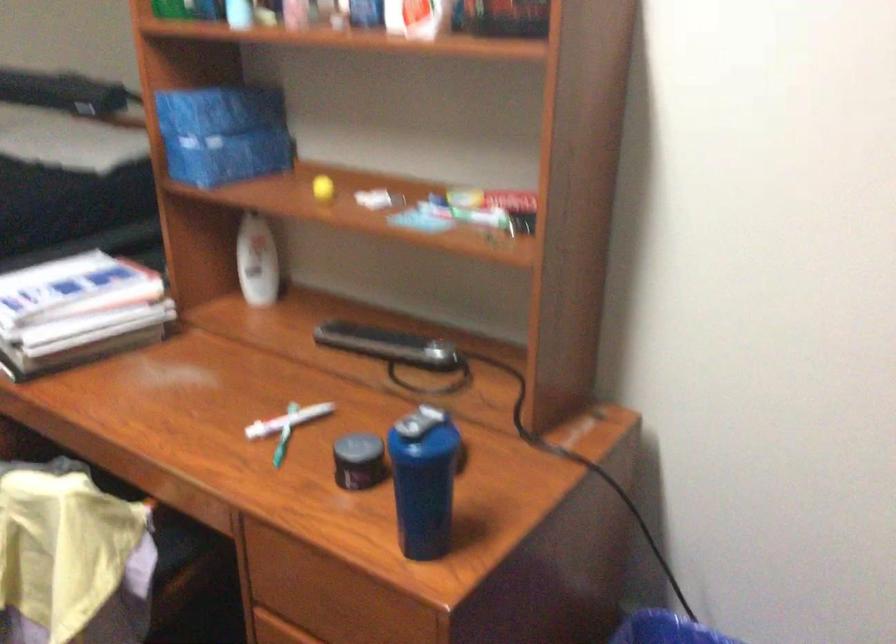
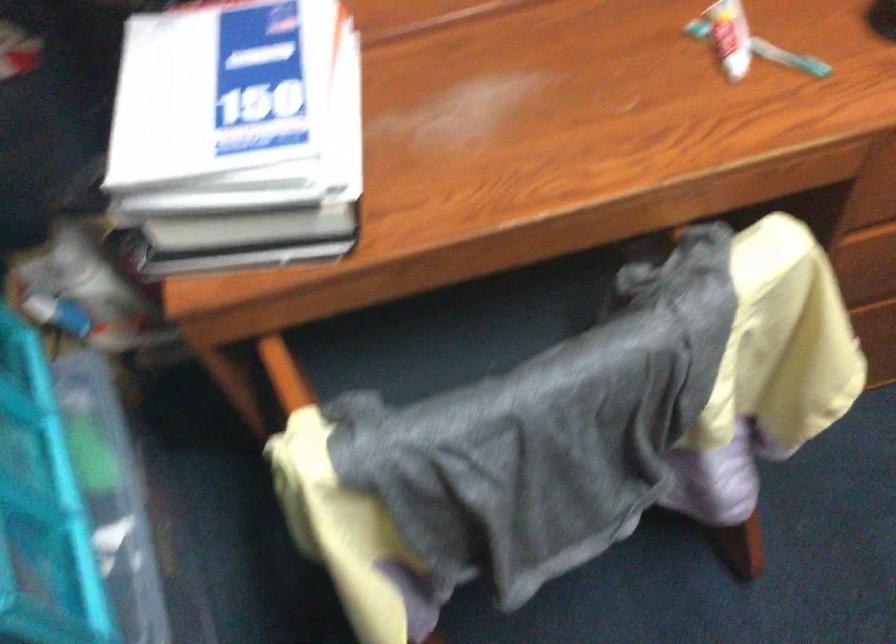
Find the pixel in the second image that matches pixel 286 453 in the first image.

(789, 58)